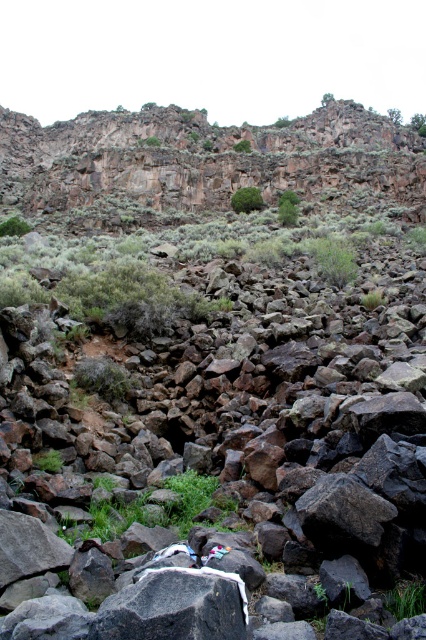
You are a hiker navigating through this rocky terrain. You see a green leafy bush at center and a green leafy shrub at lower left. Which one is located higher up in the landscape?

The green leafy bush at center is positioned over the green leafy shrub at lower left, so it is higher up in the landscape.

You are standing at the base of the cliff and see two points marked on the ground. The first point is labeled as point (x=249, y=188) and the second is point (x=3, y=228). If you want to reach the point that is closer to the cliff, which point should you head towards?

Point (x=249, y=188) is behind point (x=3, y=228), so it is closer to the cliff. Therefore, you should head towards point (x=249, y=188) to reach the one closer to the cliff.

You are a hiker trying to navigate through the rocky terrain. You see the gray rock at center and the rugged rock cliff at upper center. Which object is closer to you?

The gray rock at center is closer to the viewer than the rugged rock cliff at upper center.